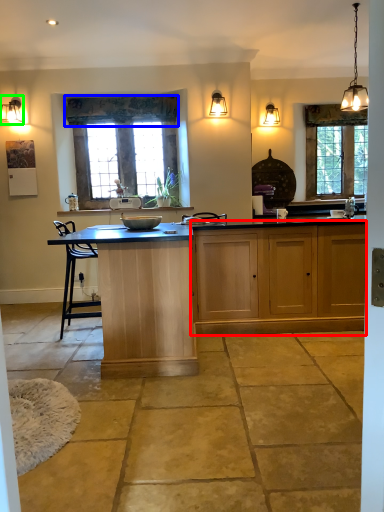
Question: Which is farther away from cabinetry (highlighted by a red box)? curtain (highlighted by a blue box) or lamp (highlighted by a green box)?

Choices:
 (A) curtain
 (B) lamp

Answer: (B)